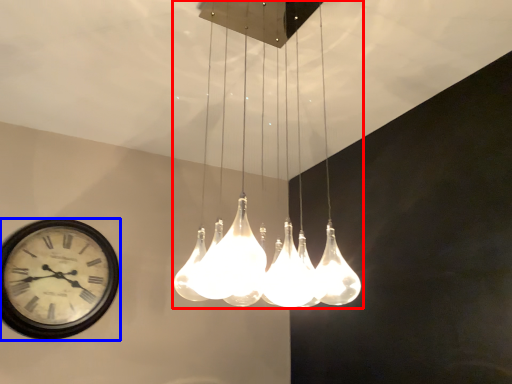
Question: Which object appears farthest to the camera in this image, lamp (highlighted by a red box) or wall clock (highlighted by a blue box)?

Choices:
 (A) lamp
 (B) wall clock

Answer: (B)